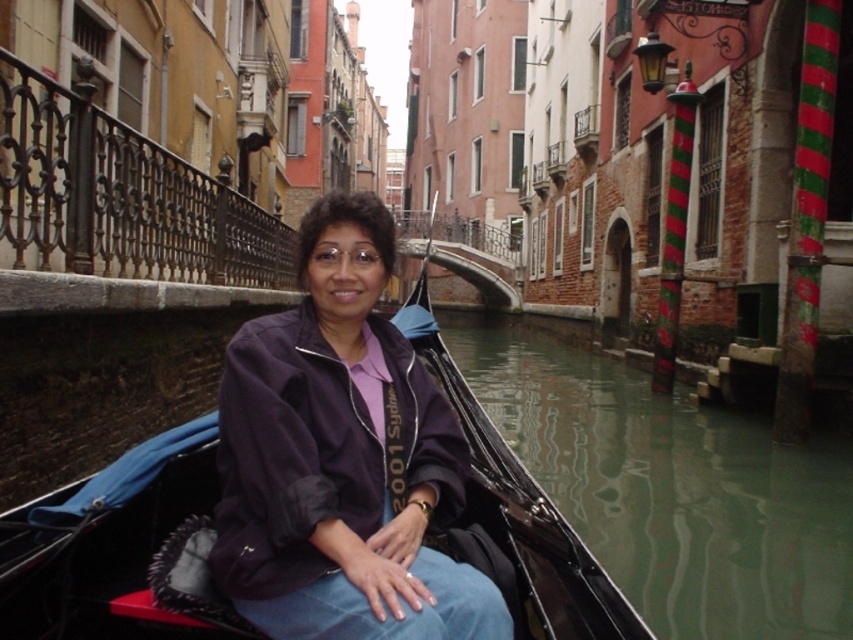
You are a photographer trying to capture the perfect shot of the dark purple jacket at center. To ensure the jacket is centered in your photo, where should you position your camera?

The dark purple jacket at center is located at the 2D coordinates point [341,458], so you should position your camera to focus on that point to center the jacket in the photo.

You are a tourist in Venice and want to take a photo of the black leather boat at center from the green reflective water at lower center. Is the water surface above or below the boat?

The green reflective water at lower center is above the black leather boat at center, so you can take the photo from the water surface above the boat.

You are standing on a bridge overlooking the canal and want to take a photo of the green reflective water at lower center and the black leather boat at center. Which object will appear closer to you in your photo?

The green reflective water at lower center will appear closer to you in the photo because it is positioned further away from the viewer compared to the black leather boat at center, making it seem nearer in the image perspective.